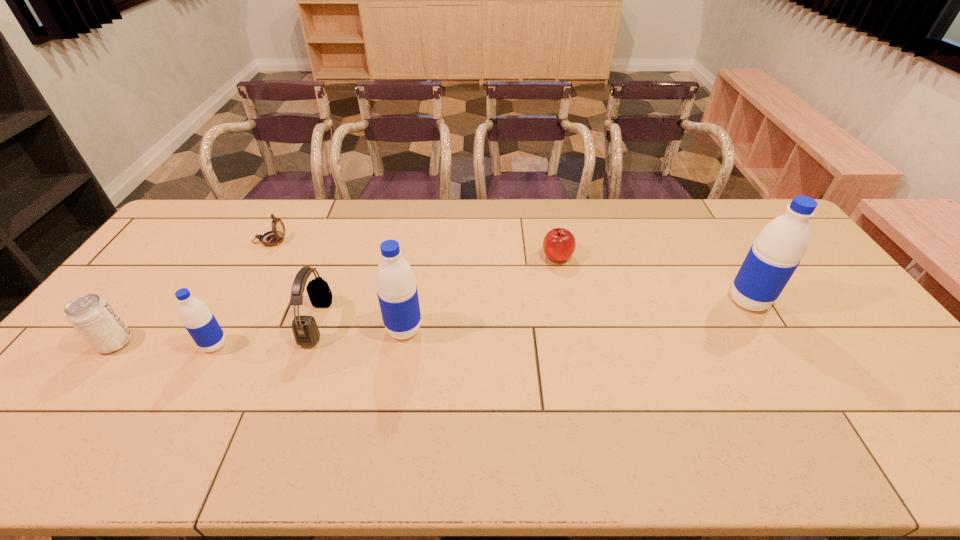
Where is `the shortest water bottle`? the shortest water bottle is located at coordinates (197, 318).

I want to click on the sixth shortest object, so click(x=397, y=292).

This screenshot has width=960, height=540. Find the location of `the third object from right to left`. the third object from right to left is located at coordinates click(397, 292).

You are a GUI agent. You are given a task and a screenshot of the screen. Output one action in this format:
    pyautogui.click(x=<x>, y=<y>)
    Task: Click on the rightmost water bottle
    This screenshot has width=960, height=540.
    Given the screenshot: What is the action you would take?
    pyautogui.click(x=777, y=251)

Image resolution: width=960 pixels, height=540 pixels. Identify the location of compass. (271, 238).

Locate an element on the screen. The width and height of the screenshot is (960, 540). the fourth object from left to right is located at coordinates (306, 333).

Find the location of `the second object from right to left`. the second object from right to left is located at coordinates (559, 244).

Locate an element on the screen. The width and height of the screenshot is (960, 540). soda can is located at coordinates (92, 316).

The image size is (960, 540). In order to click on the third shortest object in this screenshot , I will do `click(92, 316)`.

Locate an element on the screen. The height and width of the screenshot is (540, 960). vacant area situated 0.230m on the left of the shortest water bottle is located at coordinates [116, 345].